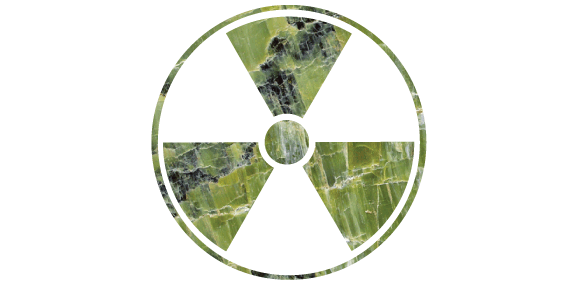
The image size is (570, 284). Find the location of `crackle looking paint on the fan like blades in green, gray, white, and black`. crackle looking paint on the fan like blades in green, gray, white, and black is located at coordinates (364, 160), (337, 166), (374, 192), (348, 202).